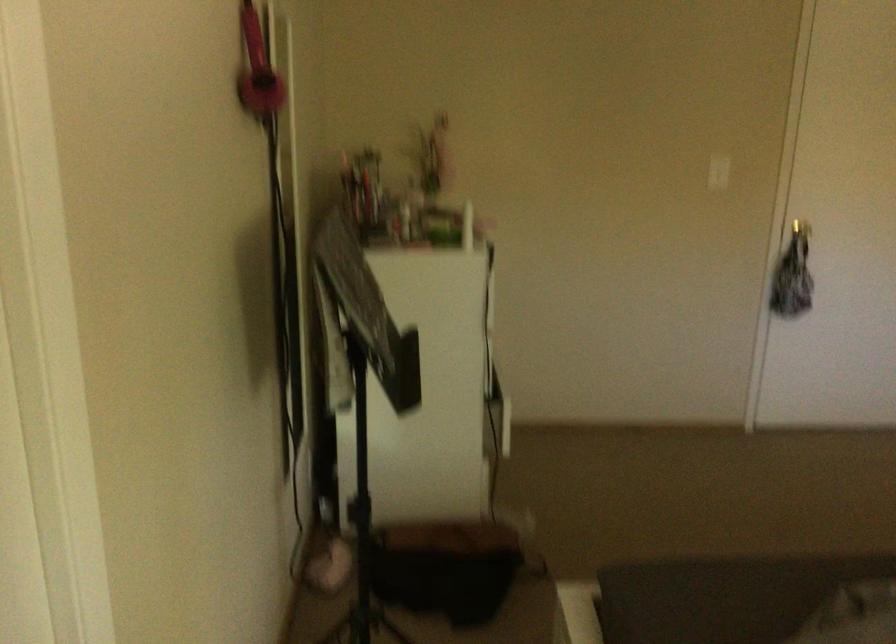
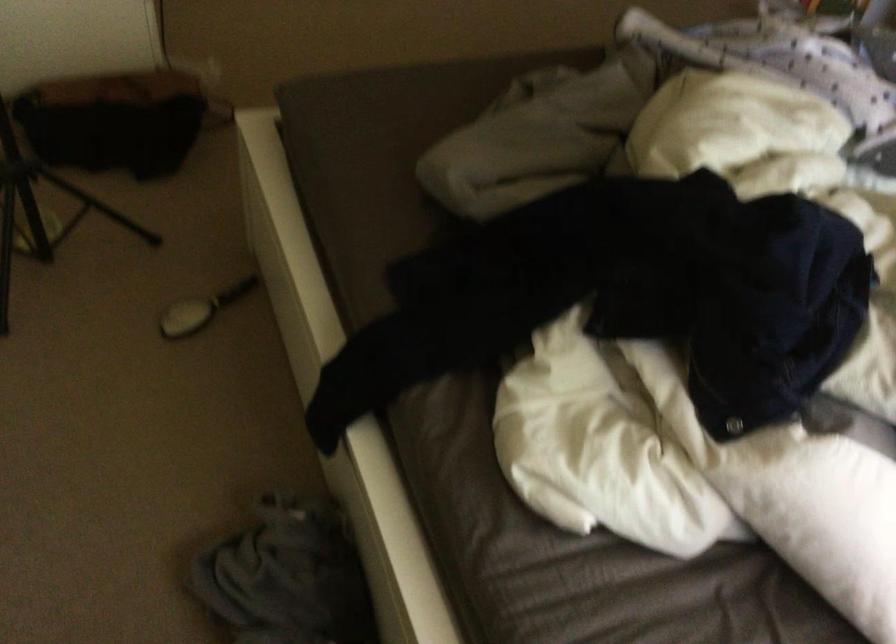
The images are taken continuously from a first-person perspective. In which direction is your viewpoint rotating?

The camera's rotation is toward right-down.